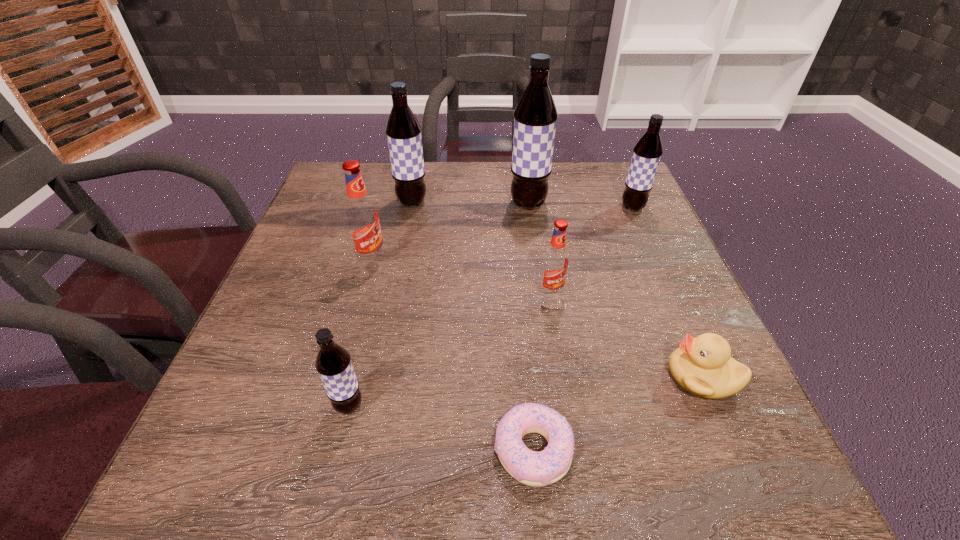
Identify the location of brown root beer that is the fourth nearest to the nearer red root beer. The image size is (960, 540). (403, 130).

The height and width of the screenshot is (540, 960). In order to click on brown root beer that is the fourth closest one to the smaller red root beer in this screenshot , I will do `click(403, 130)`.

Where is `free region that satisfies the following two spatial constraints: 1. on the back side of the third biggest brown root beer; 2. on the left side of the shortest object`? This screenshot has height=540, width=960. free region that satisfies the following two spatial constraints: 1. on the back side of the third biggest brown root beer; 2. on the left side of the shortest object is located at coordinates (511, 207).